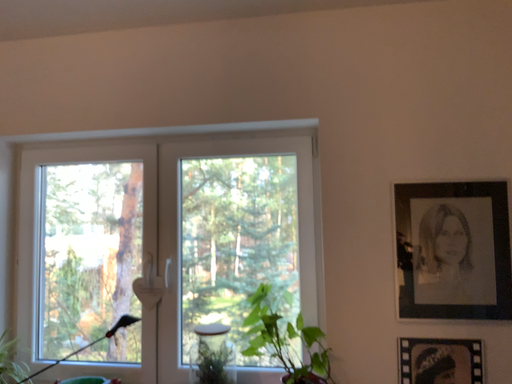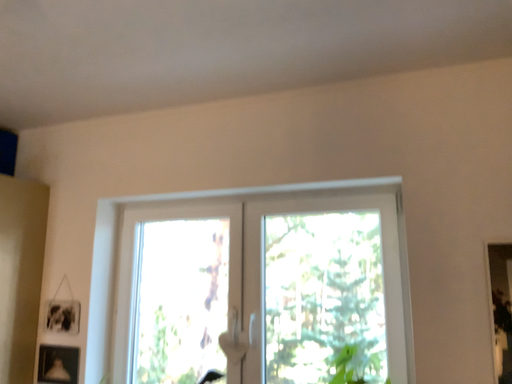
Question: How did the camera likely rotate when shooting the video?

Choices:
 (A) rotated upward
 (B) rotated downward

Answer: (A)